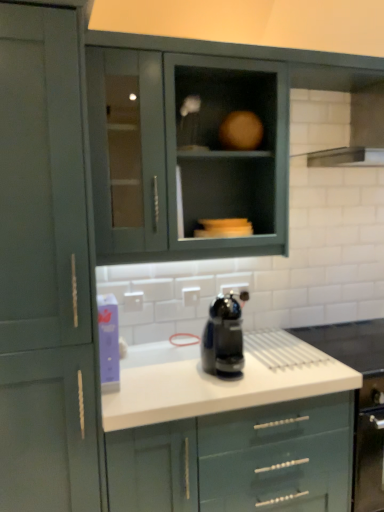
Find the location of a particular element. vacant space situated on the left part of black glossy coffee maker at center is located at coordinates (188, 374).